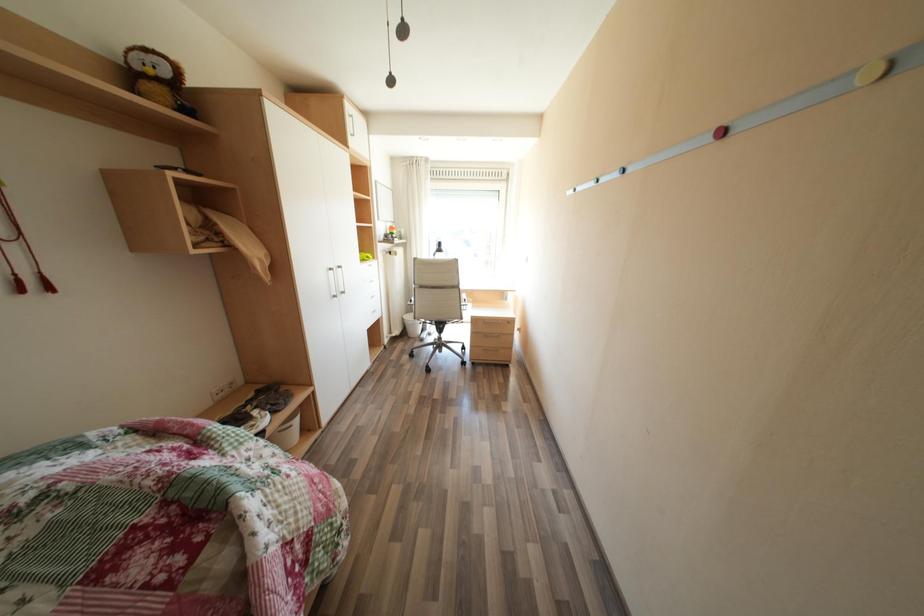
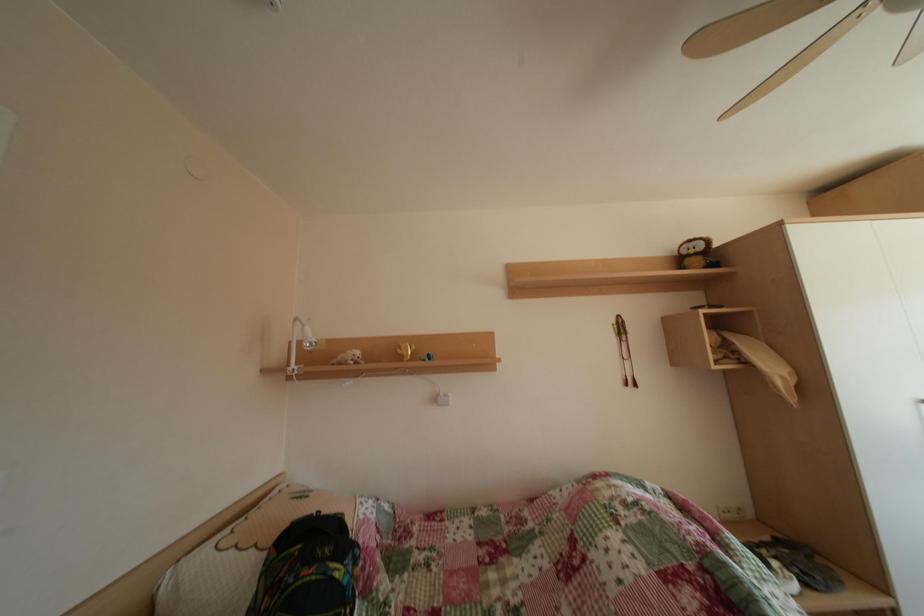
Question: The first image is from the beginning of the video and the second image is from the end. How did the camera likely rotate when shooting the video?

Choices:
 (A) Left
 (B) Right
 (C) Up
 (D) Down

Answer: (A)